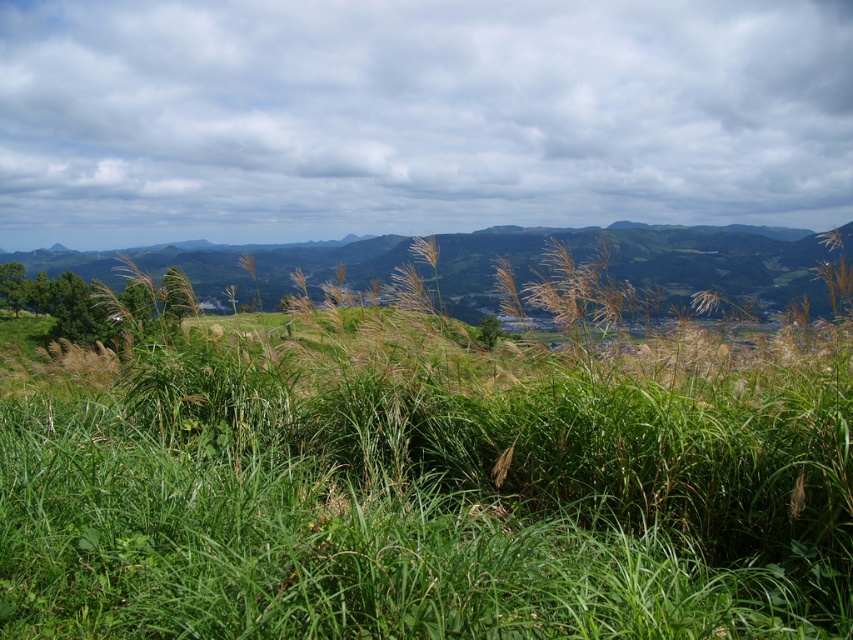
This screenshot has width=853, height=640. What do you see at coordinates (427, 486) in the screenshot? I see `green grassy at center` at bounding box center [427, 486].

How far apart are green grassy at center and cloudy sky at upper center?

A distance of 70.39 meters exists between green grassy at center and cloudy sky at upper center.

Where is `green grassy at center`? green grassy at center is located at coordinates (427, 486).